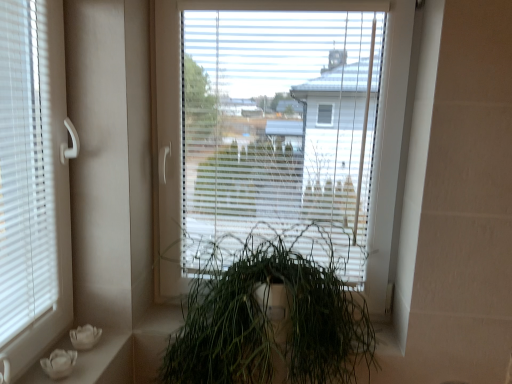
Question: From the image's perspective, is transparent plastic window at center above or below white matte flower pots at lower left?

Choices:
 (A) above
 (B) below

Answer: (A)

Question: From a real-world perspective, is transparent plastic window at center positioned above or below white matte flower pots at lower left?

Choices:
 (A) above
 (B) below

Answer: (A)

Question: Which object is positioned farthest from the transparent plastic window at center?

Choices:
 (A) green matte plant at center
 (B) white matte flower pots at lower left

Answer: (B)

Question: Which of these objects is positioned farthest from the green matte plant at center?

Choices:
 (A) transparent plastic window at center
 (B) white matte flower pots at lower left

Answer: (B)